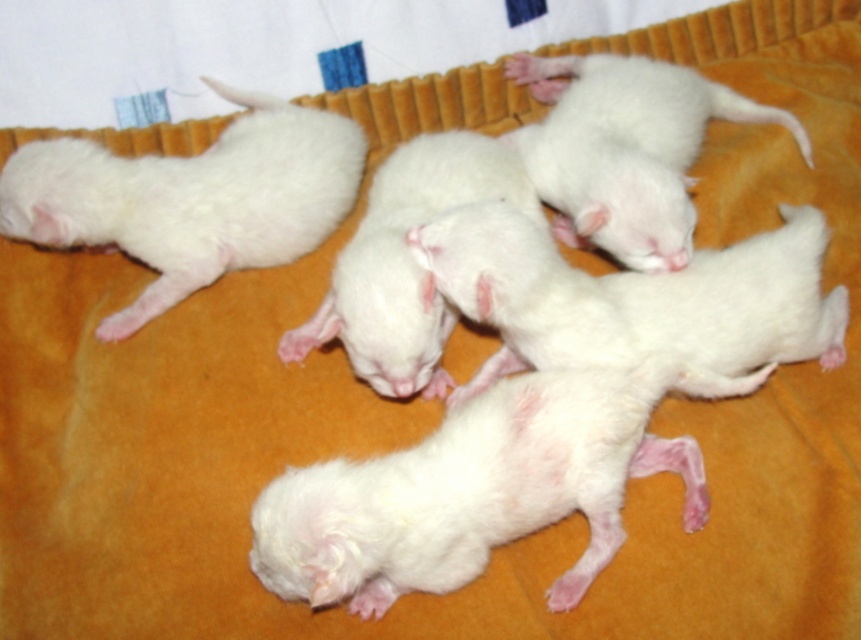
Which is above, white fluffy puppies at center or white fluffy kitten at upper left?

Positioned higher is white fluffy kitten at upper left.

Is white fluffy puppies at center smaller than white fluffy kitten at upper left?

Indeed, white fluffy puppies at center has a smaller size compared to white fluffy kitten at upper left.

The height and width of the screenshot is (640, 861). Find the location of `white fluffy puppies at center`. white fluffy puppies at center is located at coordinates (637, 300).

Does white fluffy puppy at center have a lesser height compared to white fluffy puppies at center?

In fact, white fluffy puppy at center may be taller than white fluffy puppies at center.

Which is more to the right, white fluffy puppy at center or white fluffy puppies at center?

white fluffy puppies at center is more to the right.

Where is `white fluffy puppy at center`? white fluffy puppy at center is located at coordinates (472, 492).

Based on the photo, does white fluffy puppy at center appear on the right side of white fluffy kitten at upper left?

Correct, you'll find white fluffy puppy at center to the right of white fluffy kitten at upper left.

The width and height of the screenshot is (861, 640). What are the coordinates of `white fluffy puppy at center` in the screenshot? It's located at (472, 492).